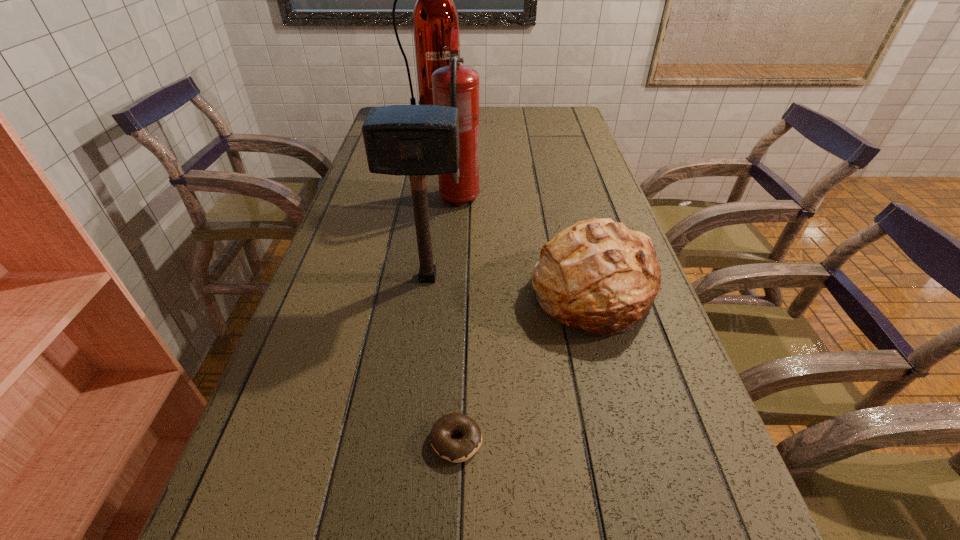
The height and width of the screenshot is (540, 960). I want to click on free space between the rightmost object and the mallet, so click(x=510, y=285).

This screenshot has width=960, height=540. In order to click on free space between the mallet and the doughnut in this screenshot , I will do `click(443, 359)`.

Select which object is the third closest to the farther fire extinguisher. Please provide its 2D coordinates. Your answer should be formatted as a tuple, i.e. [(x, y)], where the tuple contains the x and y coordinates of a point satisfying the conditions above.

[(417, 140)]

Where is `the closest object to the shortest object`? This screenshot has width=960, height=540. the closest object to the shortest object is located at coordinates (598, 276).

The width and height of the screenshot is (960, 540). What are the coordinates of `free spot that satisfies the following two spatial constraints: 1. on the front-facing side of the nearest object; 2. on the right side of the tallest object` in the screenshot? It's located at (369, 441).

Locate an element on the screen. free spot that satisfies the following two spatial constraints: 1. on the front-facing side of the mallet; 2. on the right side of the taller fire extinguisher is located at coordinates (401, 278).

Identify the location of free space that satisfies the following two spatial constraints: 1. on the front-facing side of the taller fire extinguisher; 2. on the left side of the mallet. (401, 278).